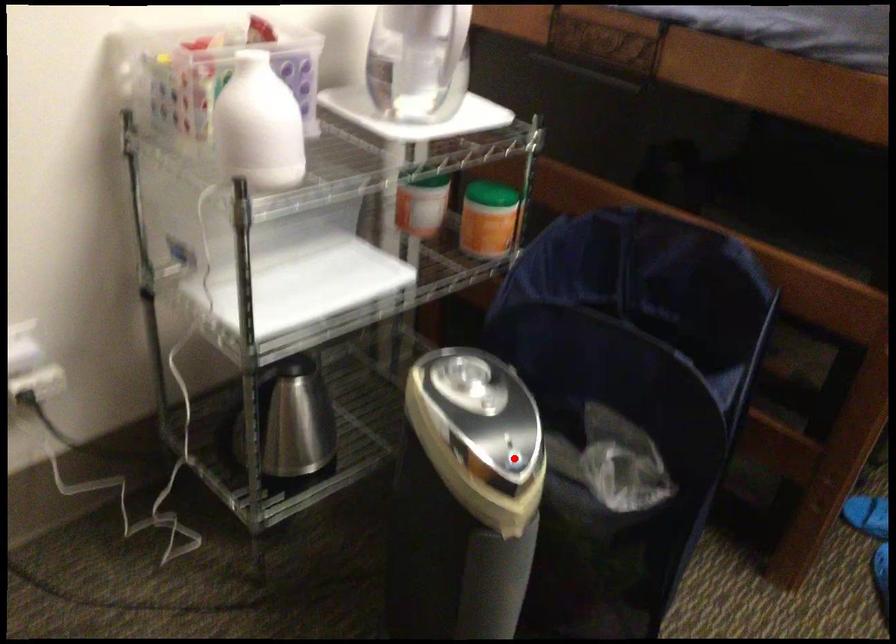
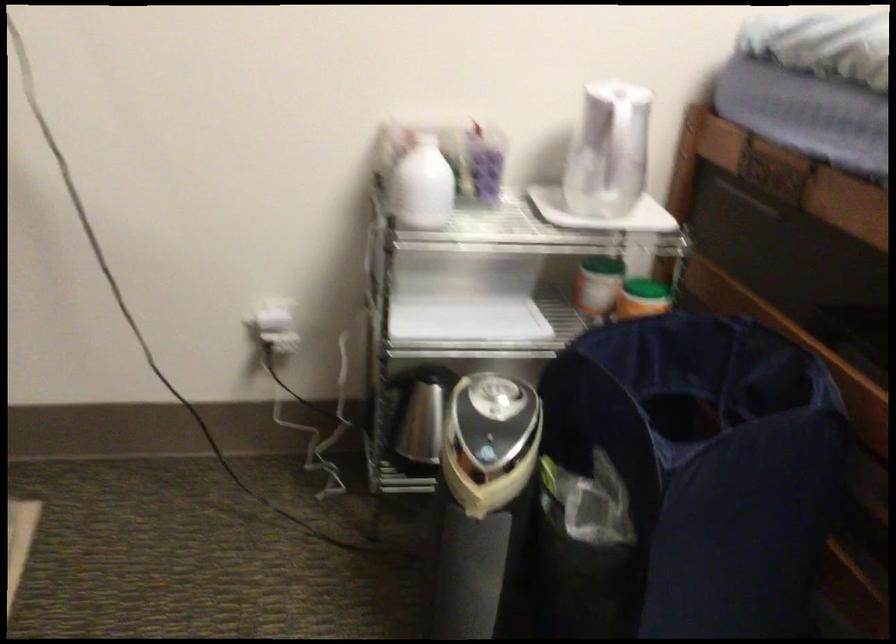
Question: I am providing you with two images of the same scene from different viewpoints. In image1, a red point is highlighted. Considering the same 3D point in image2, which of the following is correct?

Choices:
 (A) It is closer
 (B) It is farther

Answer: (B)